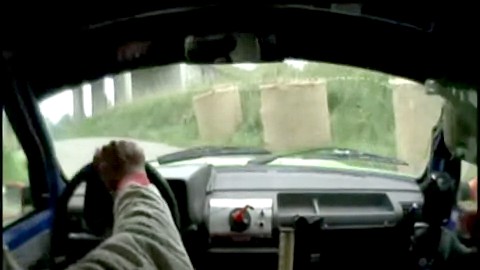
Find the location of a particular element. This screenshot has height=270, width=480. red switch is located at coordinates (238, 214).